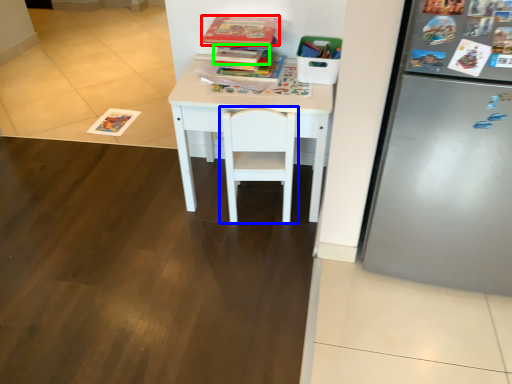
Question: Based on their relative distances, which object is nearer to book (highlighted by a red box)? Choose from chair (highlighted by a blue box) and book (highlighted by a green box).

Choices:
 (A) chair
 (B) book

Answer: (B)